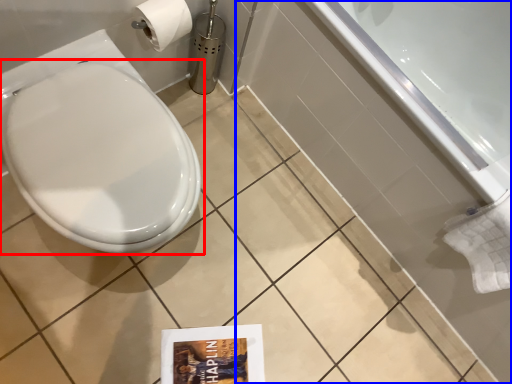
Question: Which of the following is the farthest to the observer, toilet (highlighted by a red box) or bath (highlighted by a blue box)?

Choices:
 (A) toilet
 (B) bath

Answer: (B)